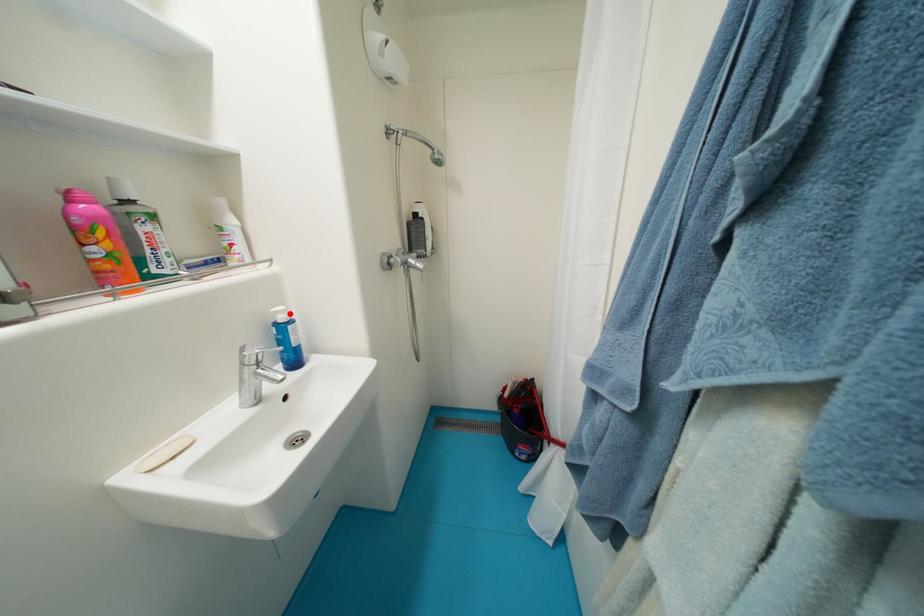
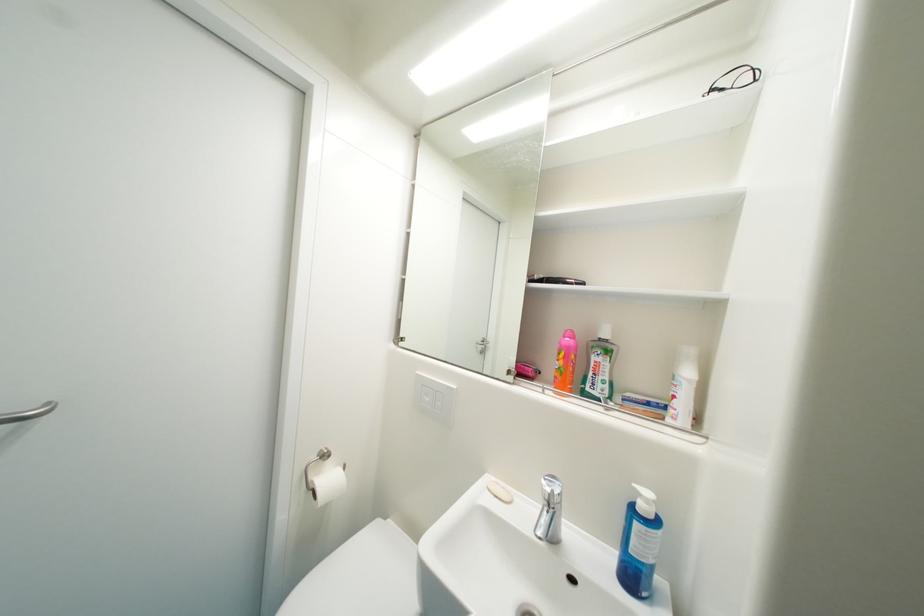
Find the pixel in the second image that matches the highlighted location in the first image.

(653, 503)